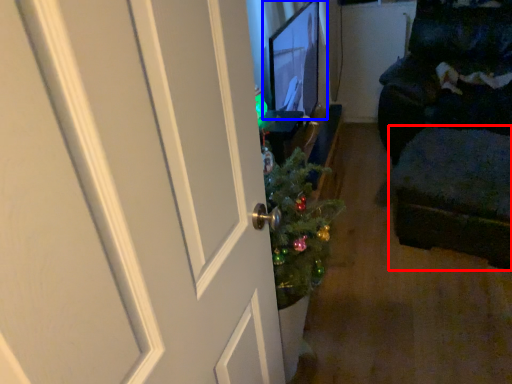
Question: Which object appears closest to the camera in this image, footrest (highlighted by a red box) or computer monitor (highlighted by a blue box)?

Choices:
 (A) footrest
 (B) computer monitor

Answer: (B)